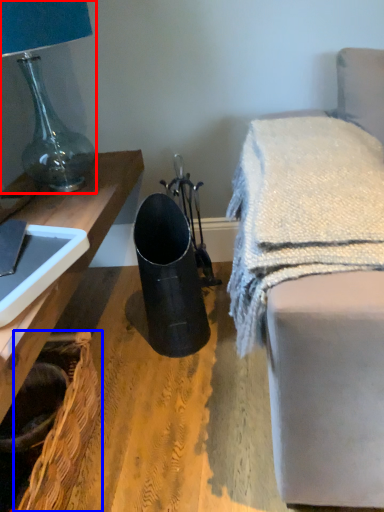
Question: Which object appears closest to the camera in this image, lamp (highlighted by a red box) or basket (highlighted by a blue box)?

Choices:
 (A) lamp
 (B) basket

Answer: (B)